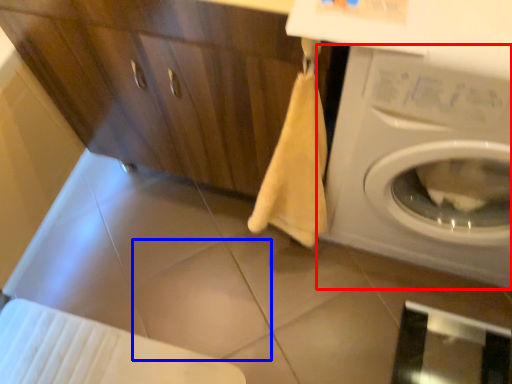
Question: Which object is further to the camera taking this photo, washing machine (highlighted by a red box) or tile (highlighted by a blue box)?

Choices:
 (A) washing machine
 (B) tile

Answer: (B)